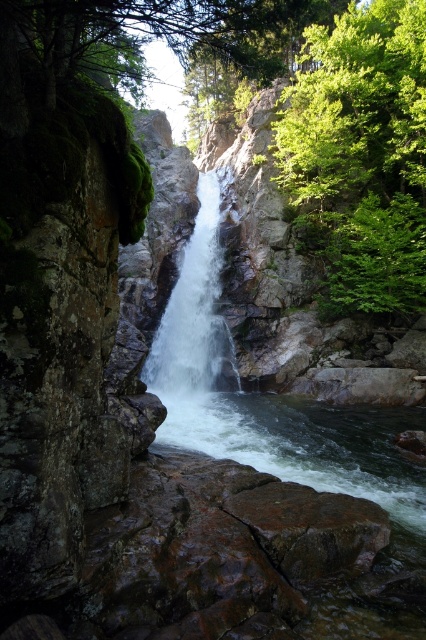
Question: Which object appears farthest from the camera in this image?

Choices:
 (A) white smooth waterfall at center
 (B) clear water at center
 (C) green leafy tree at right

Answer: (A)

Question: From the image, what is the correct spatial relationship of green leafy tree at right in relation to clear water at center?

Choices:
 (A) left
 (B) right

Answer: (B)

Question: Considering the real-world distances, which object is farthest from the white smooth waterfall at center?

Choices:
 (A) clear water at center
 (B) green leafy tree at right

Answer: (B)

Question: Can you confirm if clear water at center is positioned above white smooth waterfall at center?

Choices:
 (A) yes
 (B) no

Answer: (B)

Question: Can you confirm if green leafy tree at right is positioned to the left of white smooth waterfall at center?

Choices:
 (A) yes
 (B) no

Answer: (B)

Question: Based on their relative distances, which object is nearer to the green leafy tree at right?

Choices:
 (A) clear water at center
 (B) white smooth waterfall at center

Answer: (B)